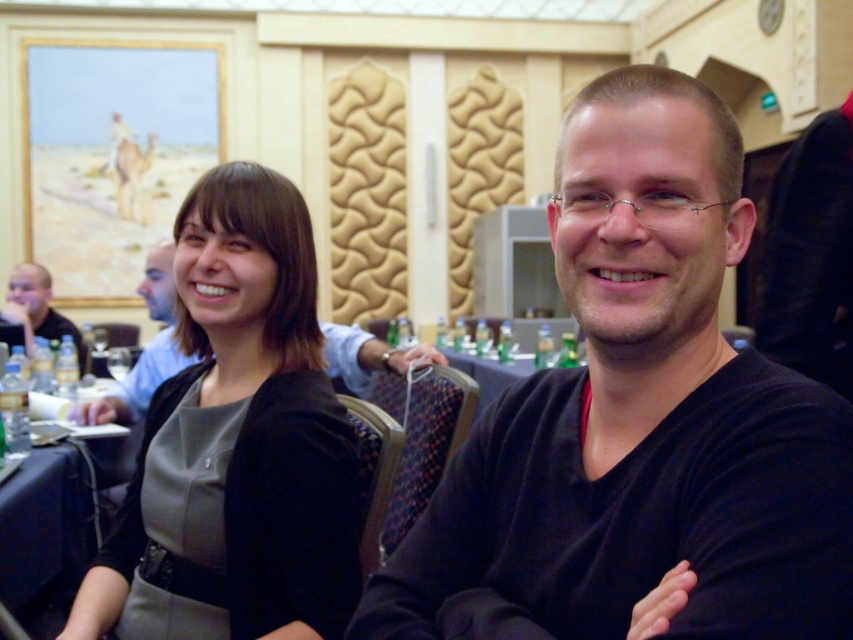
Where is the matte black shirt at left located in the image?

The matte black shirt at left is located at point coordinates of (x=38, y=307).

You are standing in the conference room and want to take a photo of both point (280, 538) and point (158, 259). Which point should you focus on first to ensure both are in sharp focus?

You should focus on point (280, 538) first because it is closer to the camera than point (158, 259). By focusing on the closer point, the farther point will also be within the depth of field and in focus.